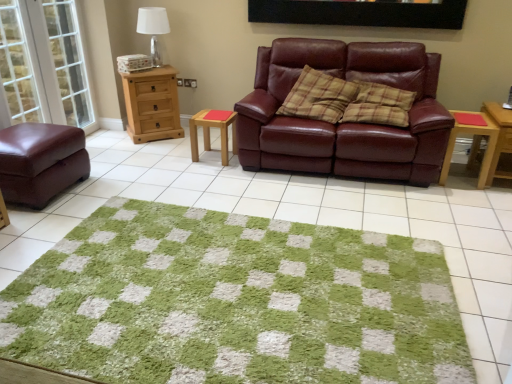
Locate an element on the screen. The height and width of the screenshot is (384, 512). vacant position to the left of natural wood chest of drawers at left is located at coordinates (109, 135).